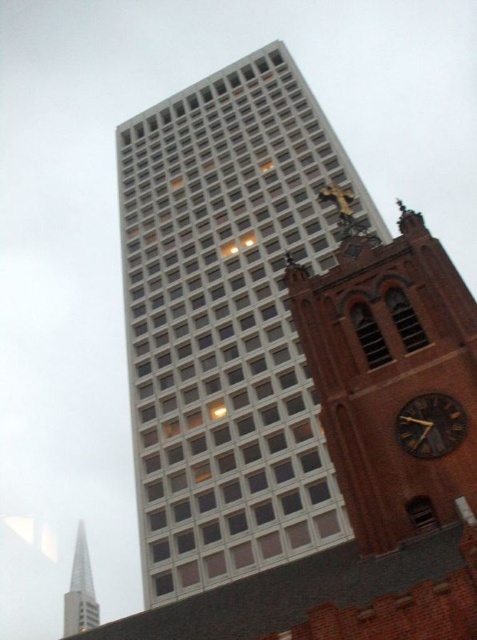
Which is below, dark brown wooden clock at right or shiny silver spire at lower left?

shiny silver spire at lower left

The height and width of the screenshot is (640, 477). What are the coordinates of `dark brown wooden clock at right` in the screenshot? It's located at pyautogui.click(x=431, y=426).

Describe the element at coordinates (393, 380) in the screenshot. The height and width of the screenshot is (640, 477). I see `brown brick clock tower at right` at that location.

Can you confirm if brown brick clock tower at right is thinner than shiny silver spire at lower left?

Indeed, brown brick clock tower at right has a lesser width compared to shiny silver spire at lower left.

Describe the element at coordinates (393, 380) in the screenshot. This screenshot has height=640, width=477. I see `brown brick clock tower at right` at that location.

You are a GUI agent. You are given a task and a screenshot of the screen. Output one action in this format:
    pyautogui.click(x=<x>, y=<y>)
    Task: Click on the brown brick clock tower at right
    Image resolution: width=477 pixels, height=640 pixels.
    Given the screenshot: What is the action you would take?
    pyautogui.click(x=393, y=380)

Can you confirm if white glass building at center is shorter than brown brick clock tower at right?

No.

Is white glass building at center below brown brick clock tower at right?

No.

You are a GUI agent. You are given a task and a screenshot of the screen. Output one action in this format:
    pyautogui.click(x=<x>, y=<y>)
    Task: Click on the white glass building at center
    The image size is (477, 640).
    Given the screenshot: What is the action you would take?
    pyautogui.click(x=228, y=323)